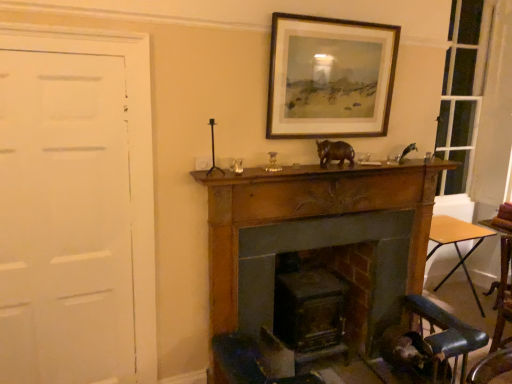
At what (x,y) coordinates should I click in order to perform the action: click on smooth wood fireplace at center, which is the 2th fireplace in back-to-front order. Please return your answer as a coordinate pair (x, y). The width and height of the screenshot is (512, 384). Looking at the image, I should click on (320, 240).

The image size is (512, 384). What do you see at coordinates (320, 240) in the screenshot?
I see `smooth wood fireplace at center, which is the 2th fireplace in back-to-front order` at bounding box center [320, 240].

Measure the distance between brown wooden mantle at center and camera.

The depth of brown wooden mantle at center is 2.10 meters.

This screenshot has width=512, height=384. What do you see at coordinates (407, 151) in the screenshot?
I see `metallic silver bird at upper right, which is counted as the second animal, starting from the front` at bounding box center [407, 151].

Where is `metallic silver bird at upper right, which is the first animal from right to left`? The height and width of the screenshot is (384, 512). metallic silver bird at upper right, which is the first animal from right to left is located at coordinates (407, 151).

What do you see at coordinates (457, 244) in the screenshot?
I see `wooden at right` at bounding box center [457, 244].

What is the approximate height of wooden at right?

wooden at right is 28.36 inches tall.

The image size is (512, 384). In order to click on brown matte rhino at center, acting as the 1th animal starting from the left in this screenshot , I will do `click(334, 152)`.

I want to click on wooden framed painting at upper center, so click(x=330, y=77).

I want to click on smooth wood fireplace at center, which is the 2th fireplace in back-to-front order, so click(320, 240).

In the image, is metallic silver bird at upper right, arranged as the 2th animal when viewed from the left, positioned in front of or behind wooden framed painting at upper center?

Clearly, metallic silver bird at upper right, arranged as the 2th animal when viewed from the left, is behind wooden framed painting at upper center.

From their relative heights in the image, would you say metallic silver bird at upper right, which is counted as the second animal, starting from the front, is taller or shorter than wooden framed painting at upper center?

Clearly, metallic silver bird at upper right, which is counted as the second animal, starting from the front, is shorter compared to wooden framed painting at upper center.

From a real-world perspective, is metallic silver bird at upper right, which is the first animal from right to left, below wooden framed painting at upper center?

Yes, from a real-world perspective, metallic silver bird at upper right, which is the first animal from right to left, is below wooden framed painting at upper center.

Is metallic silver bird at upper right, which is the 1th animal in back-to-front order, bigger than wooden framed painting at upper center?

No.

Is wooden at right facing towards metallic silver bird at upper right, which is counted as the second animal, starting from the front?

No, wooden at right is not oriented towards metallic silver bird at upper right, which is counted as the second animal, starting from the front.

Is wooden at right shorter than metallic silver bird at upper right, which is the 1th animal in back-to-front order?

In fact, wooden at right may be taller than metallic silver bird at upper right, which is the 1th animal in back-to-front order.

Does wooden at right lie behind metallic silver bird at upper right, arranged as the 2th animal when viewed from the left?

Yes, it is behind metallic silver bird at upper right, arranged as the 2th animal when viewed from the left.

From a real-world perspective, who is located higher, wooden at right or metallic silver bird at upper right, which is counted as the second animal, starting from the front?

In real-world perspective, metallic silver bird at upper right, which is counted as the second animal, starting from the front, is above.

From the image's perspective, which is above, dark gray stone fireplace at center, acting as the first fireplace starting from the back, or white matte door at left?

white matte door at left, from the image's perspective.

At what (x,y) coordinates should I click in order to perform the action: click on door on the left of the dark gray stone fireplace at center, acting as the first fireplace starting from the back. Please return your answer as a coordinate pair (x, y). The height and width of the screenshot is (384, 512). Looking at the image, I should click on (64, 220).

Is dark gray stone fireplace at center, which is the 2th fireplace from front to back, oriented away from white matte door at left?

No, dark gray stone fireplace at center, which is the 2th fireplace from front to back,'s orientation is not away from white matte door at left.

Can you confirm if white matte door at left is smaller than metallic silver bird at upper right, which is the first animal from right to left?

No.

Considering the relative sizes of white matte door at left and metallic silver bird at upper right, which is the first animal from right to left, in the image provided, is white matte door at left taller than metallic silver bird at upper right, which is the first animal from right to left,?

Yes.

Measure the distance from wooden framed painting at upper center to brown wooden mantle at center.

wooden framed painting at upper center is 18.35 inches from brown wooden mantle at center.

Can you confirm if wooden framed painting at upper center is smaller than brown wooden mantle at center?

Incorrect, wooden framed painting at upper center is not smaller in size than brown wooden mantle at center.

Is point (352, 37) farther from camera compared to point (352, 173)?

No, (352, 37) is in front of (352, 173).

From the image's perspective, which is above, smooth wood fireplace at center, which appears as the first fireplace when viewed from the front, or white matte door at left?

white matte door at left.

What's the angular difference between smooth wood fireplace at center, which appears as the first fireplace when viewed from the front, and white matte door at left's facing directions?

There is a 1.99-degree angle between the facing directions of smooth wood fireplace at center, which appears as the first fireplace when viewed from the front, and white matte door at left.

From a real-world perspective, is smooth wood fireplace at center, which appears as the first fireplace when viewed from the front, positioned under white matte door at left based on gravity?

Correct, in the physical world, smooth wood fireplace at center, which appears as the first fireplace when viewed from the front, is lower than white matte door at left.

Is white matte door at left located within smooth wood fireplace at center, which is the 2th fireplace in back-to-front order?

No, white matte door at left is not surrounded by smooth wood fireplace at center, which is the 2th fireplace in back-to-front order.

From the image's perspective, which object appears higher, wooden folding table at lower right or brown wooden mantle at center?

From the image's view, brown wooden mantle at center is above.

How different are the orientations of wooden folding table at lower right and brown wooden mantle at center in degrees?

94.1 degrees.

Is wooden folding table at lower right closer to the viewer compared to brown wooden mantle at center?

No, wooden folding table at lower right is behind brown wooden mantle at center.

Does wooden folding table at lower right touch brown wooden mantle at center?

No, wooden folding table at lower right is not next to brown wooden mantle at center.

Identify the location of animal that is the 2nd one when counting backward from the wooden framed painting at upper center. The height and width of the screenshot is (384, 512). (407, 151).

From the image's perspective, count 2nd animals upward from the wooden at right and point to it. Please provide its 2D coordinates.

[(407, 151)]

Which object lies further to the anchor point wooden at right, wooden folding table at lower right or smooth wood fireplace at center, which is the 2th fireplace in back-to-front order?

Based on the image, smooth wood fireplace at center, which is the 2th fireplace in back-to-front order, appears to be further to wooden at right.

Based on their spatial positions, is wooden folding table at lower right or wooden framed painting at upper center further from dark gray stone fireplace at center, which is the 2th fireplace from front to back?

The object further to dark gray stone fireplace at center, which is the 2th fireplace from front to back, is wooden folding table at lower right.

When comparing their distances from white matte door at left, does wooden folding table at lower right or brown matte rhino at center, arranged as the first animal when viewed from the front, seem further?

Based on the image, wooden folding table at lower right appears to be further to white matte door at left.

Based on their spatial positions, is wooden framed painting at upper center or brown matte rhino at center, arranged as the first animal when viewed from the front, closer to metallic silver bird at upper right, arranged as the 2th animal when viewed from the left?

brown matte rhino at center, arranged as the first animal when viewed from the front, lies closer to metallic silver bird at upper right, arranged as the 2th animal when viewed from the left, than the other object.

In the scene shown: When comparing their distances from wooden at right, does wooden folding table at lower right or white matte door at left seem closer?

wooden folding table at lower right is positioned closer to the anchor wooden at right.

Estimate the real-world distances between objects in this image. Which object is further from brown wooden mantle at center, smooth wood fireplace at center, which is the 2th fireplace in back-to-front order, or metallic silver bird at upper right, arranged as the 2th animal when viewed from the left?

metallic silver bird at upper right, arranged as the 2th animal when viewed from the left, lies further to brown wooden mantle at center than the other object.

Which object lies further to the anchor point dark gray stone fireplace at center, which is the 2th fireplace from front to back, smooth wood fireplace at center, which appears as the first fireplace when viewed from the front, or wooden at right?

wooden at right.

Estimate the real-world distances between objects in this image. Which object is closer to wooden at right, white matte door at left or brown wooden mantle at center?

brown wooden mantle at center lies closer to wooden at right than the other object.

What are the coordinates of `mantle located between brown matte rhino at center, acting as the 1th animal starting from the left, and wooden folding table at lower right in the left-right direction` in the screenshot? It's located at (319, 172).

Identify the location of animal situated between wooden framed painting at upper center and wooden folding table at lower right from left to right. The image size is (512, 384). (407, 151).

Where is `picture frame located between brown matte rhino at center, arranged as the first animal when viewed from the front, and metallic silver bird at upper right, which is counted as the second animal, starting from the front, in the left-right direction`? picture frame located between brown matte rhino at center, arranged as the first animal when viewed from the front, and metallic silver bird at upper right, which is counted as the second animal, starting from the front, in the left-right direction is located at coordinates (330, 77).

I want to click on fireplace between brown wooden mantle at center and dark gray stone fireplace at center, acting as the first fireplace starting from the back, vertically, so click(320, 240).